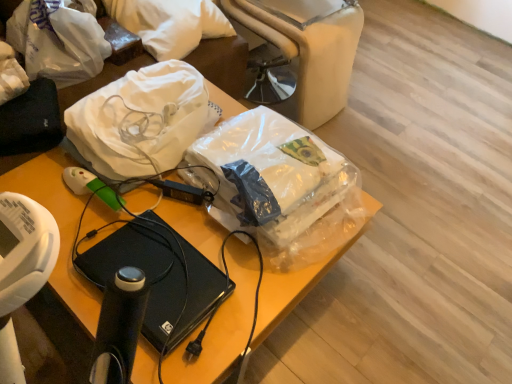
Where is `vacant area situated below black matte laptop at center (from a real-world perspective)`? vacant area situated below black matte laptop at center (from a real-world perspective) is located at coordinates (172, 292).